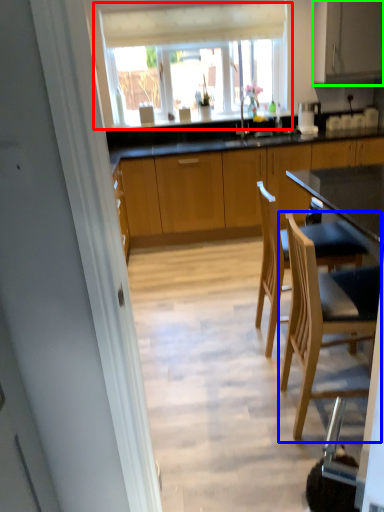
Question: Estimate the real-world distances between objects in this image. Which object is farther from window (highlighted by a red box), chair (highlighted by a blue box) or cabinetry (highlighted by a green box)?

Choices:
 (A) chair
 (B) cabinetry

Answer: (A)